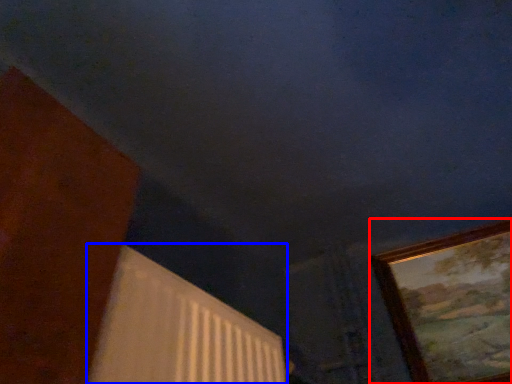
Question: Which object is further to the camera taking this photo, picture frame (highlighted by a red box) or radiator (highlighted by a blue box)?

Choices:
 (A) picture frame
 (B) radiator

Answer: (A)